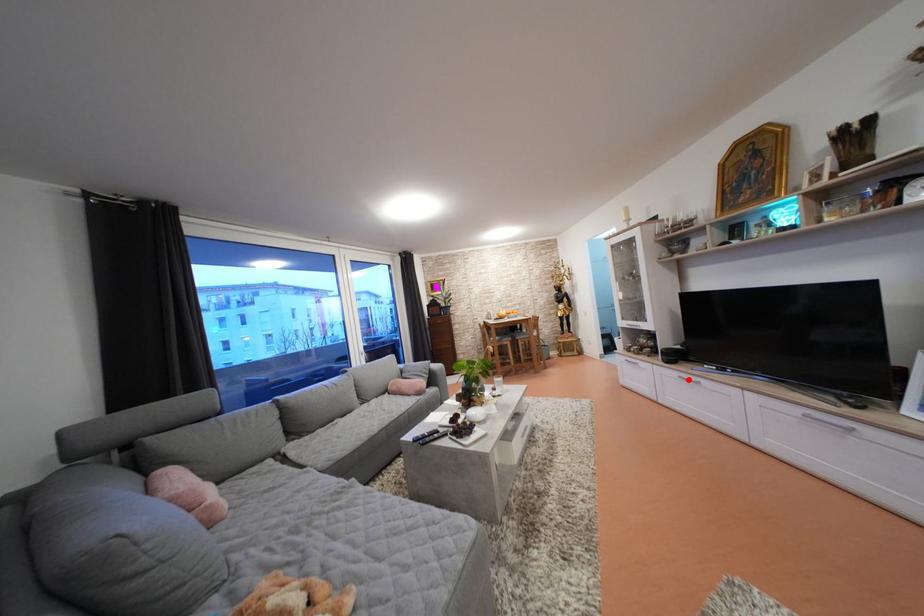
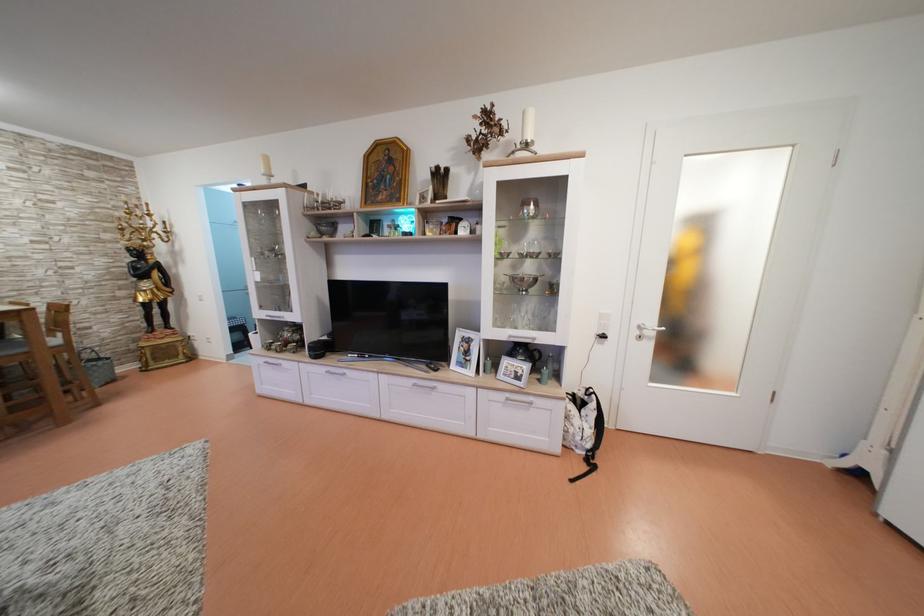
Locate, in the second image, the point that corresponds to the highlighted location in the first image.

(335, 374)